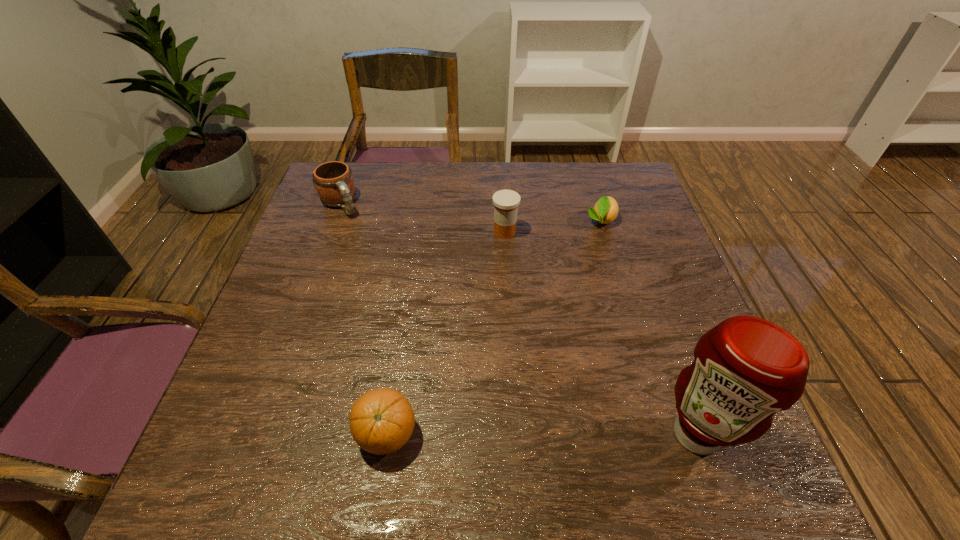
Identify the location of unoccupied area between the second object from left to right and the mug. The height and width of the screenshot is (540, 960). (363, 319).

Locate an element on the screen. This screenshot has height=540, width=960. free space that is in between the leftmost object and the medicine is located at coordinates click(x=422, y=218).

Where is `free space between the orange and the third object from right to left`? free space between the orange and the third object from right to left is located at coordinates (446, 333).

The width and height of the screenshot is (960, 540). In order to click on vacant region between the condiment and the orange in this screenshot , I will do `click(541, 434)`.

Find the location of `vacant space that is in between the leftmost object and the lemon`. vacant space that is in between the leftmost object and the lemon is located at coordinates (470, 212).

Where is `free space between the condiment and the leftmost object`? This screenshot has width=960, height=540. free space between the condiment and the leftmost object is located at coordinates (517, 319).

The image size is (960, 540). Identify the location of vacant region between the mug and the medicine. (422, 218).

Where is `empty space between the leftmost object and the third object from left to right`? The height and width of the screenshot is (540, 960). empty space between the leftmost object and the third object from left to right is located at coordinates (422, 218).

Locate an element on the screen. vacant space in between the tallest object and the medicine is located at coordinates (601, 333).

The width and height of the screenshot is (960, 540). Identify the location of free point between the condiment and the lemon. (649, 327).